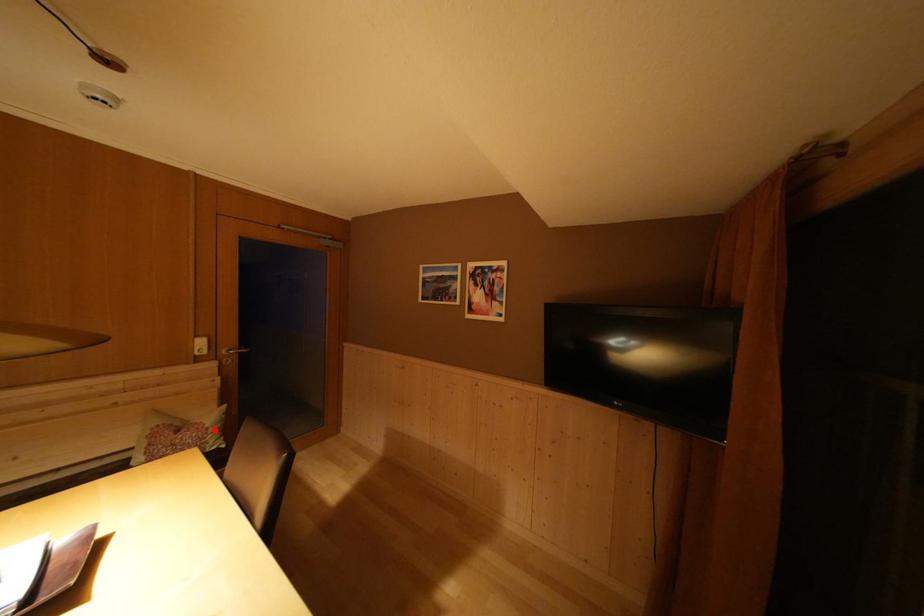
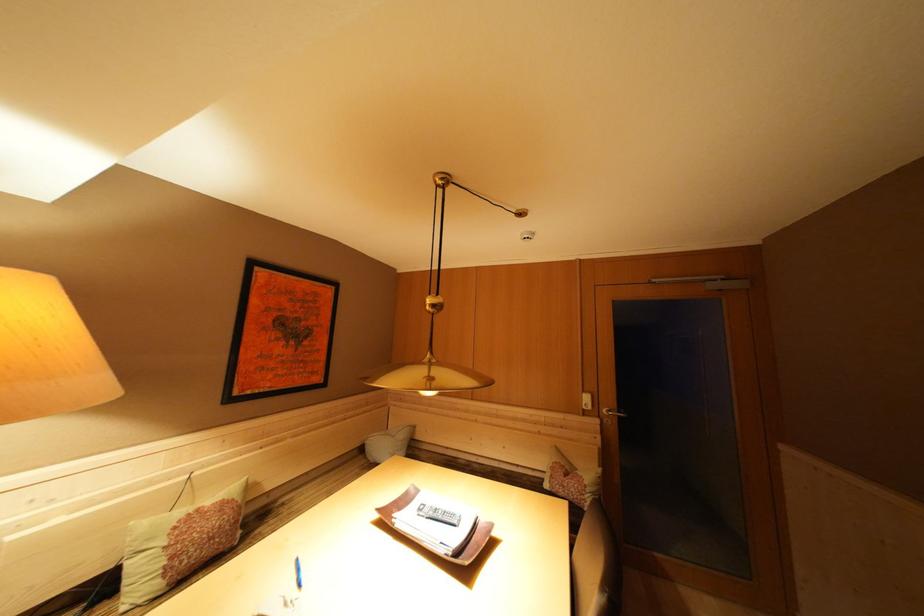
Question: I am providing you with two images of the same scene from different viewpoints. Given a red point in image1, look at the same physical point in image2. Is it:

Choices:
 (A) Closer to the viewpoint
 (B) Farther from the viewpoint

Answer: (B)